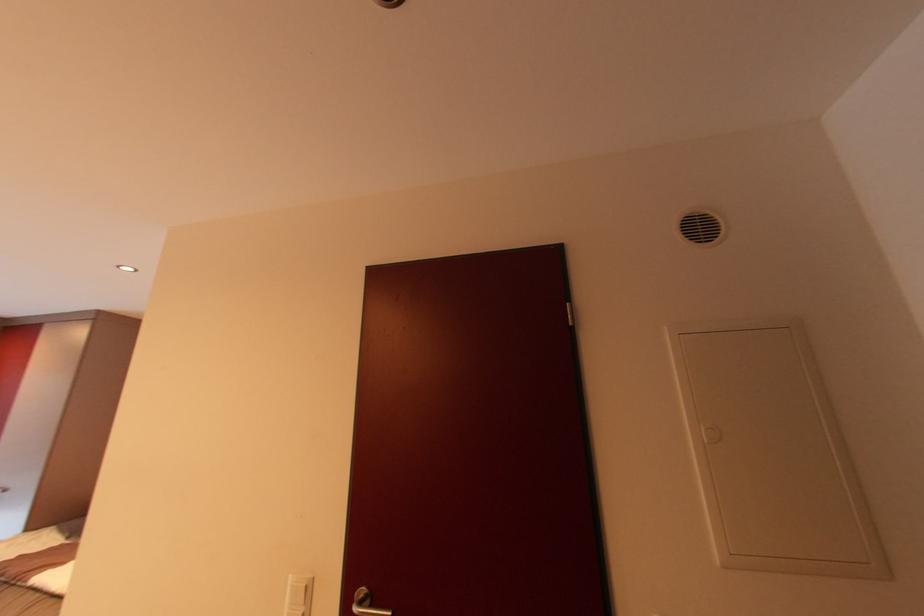
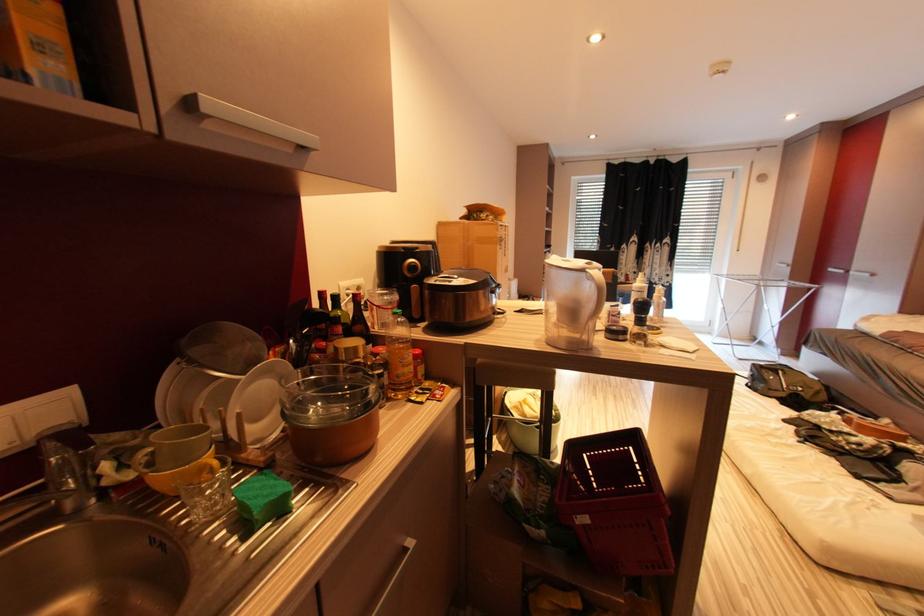
Question: The first image is from the beginning of the video and the second image is from the end. How did the camera likely rotate when shooting the video?

Choices:
 (A) Left
 (B) Right
 (C) Up
 (D) Down

Answer: (A)